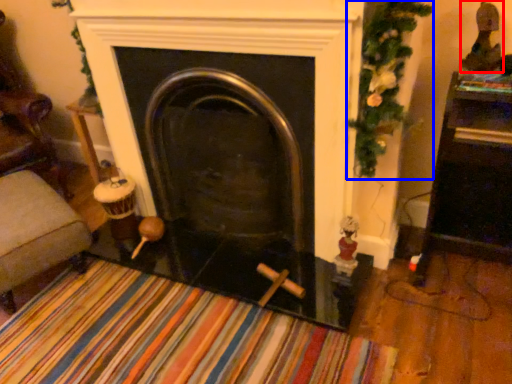
Question: Which object is closer to the camera taking this photo, toy (highlighted by a red box) or christmas decoration (highlighted by a blue box)?

Choices:
 (A) toy
 (B) christmas decoration

Answer: (B)